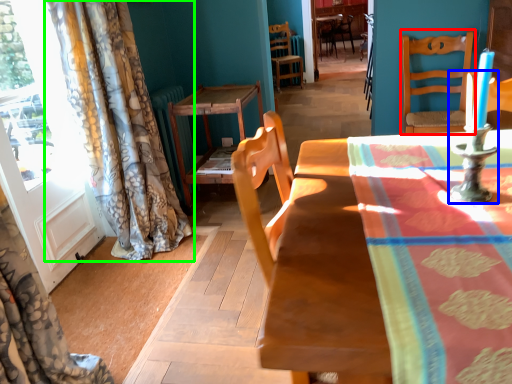
Question: Estimate the real-world distances between objects in this image. Which object is closer to chair (highlighted by a red box), candle holder (highlighted by a blue box) or curtain (highlighted by a green box)?

Choices:
 (A) candle holder
 (B) curtain

Answer: (B)